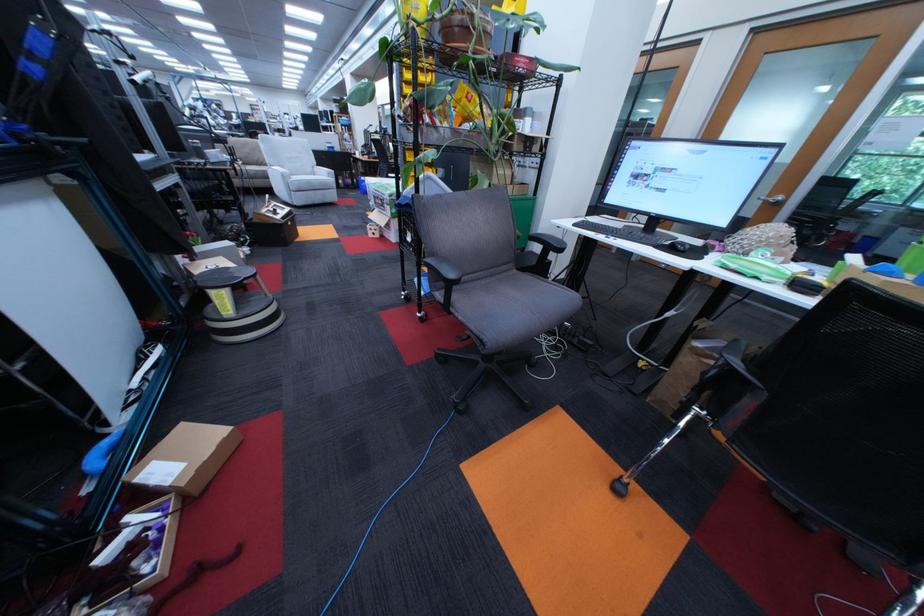
Find the location of `black computer mouse`. black computer mouse is located at coordinates (678, 246).